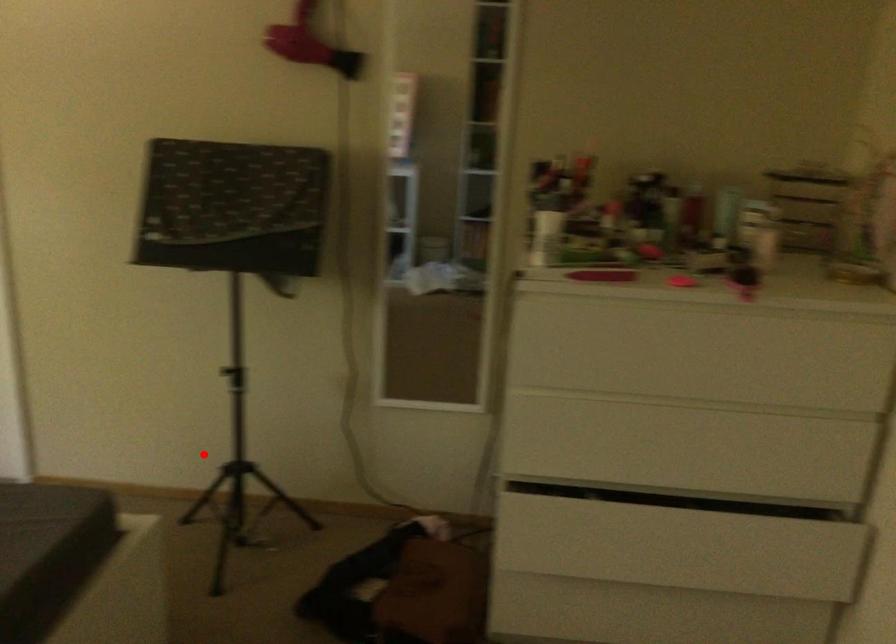
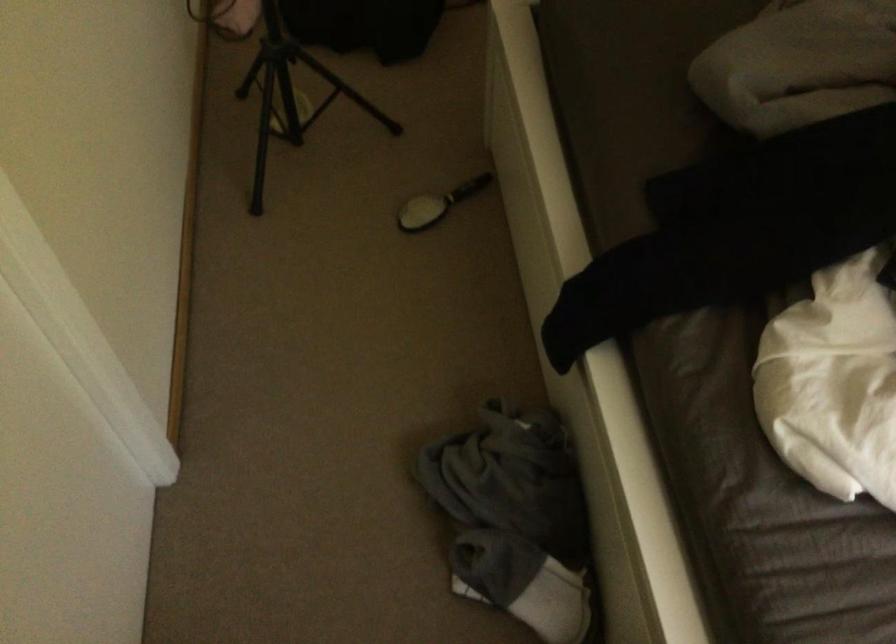
Find the pixel in the second image that matches the highlighted location in the first image.

(283, 93)